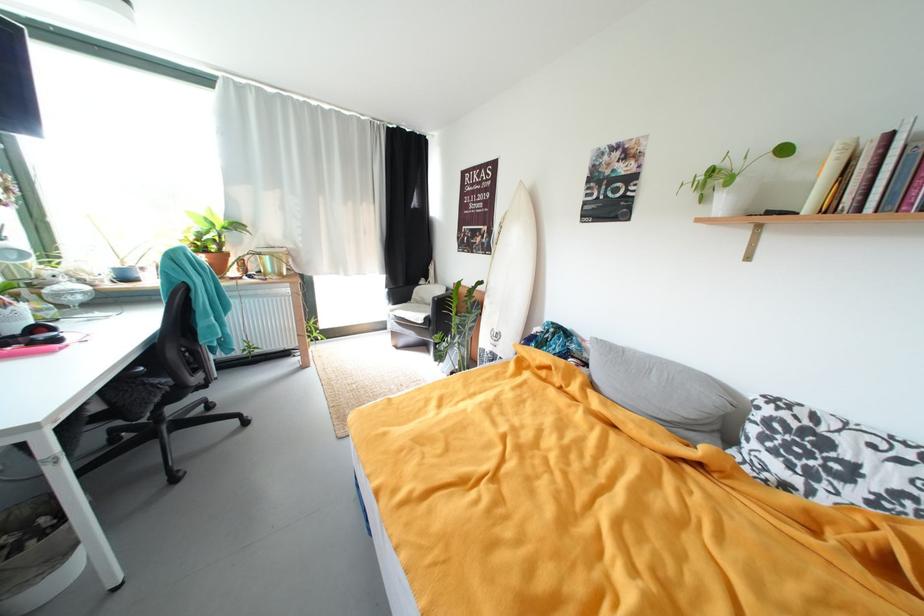
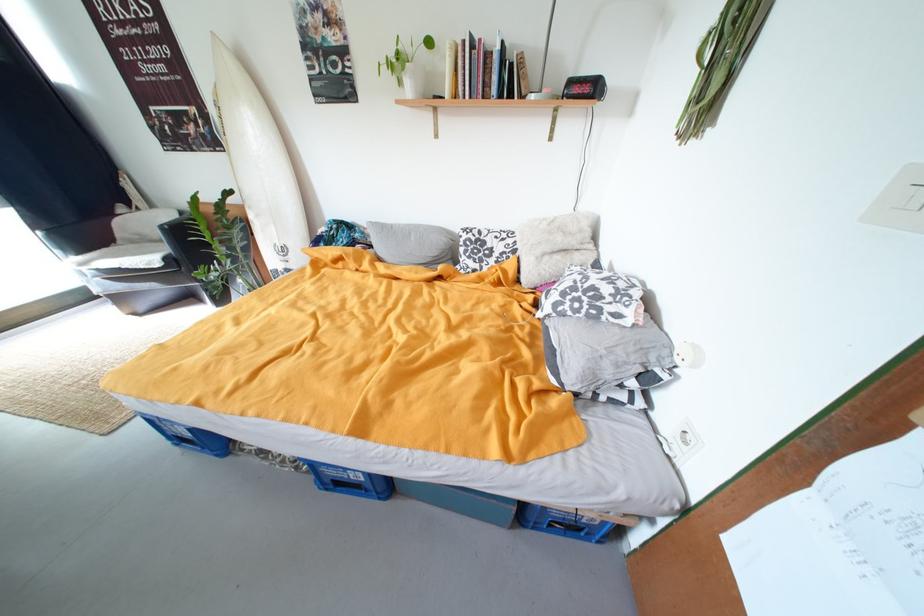
Where in the second image is the point corresponding to the point at 730,206 from the first image?

(418, 90)